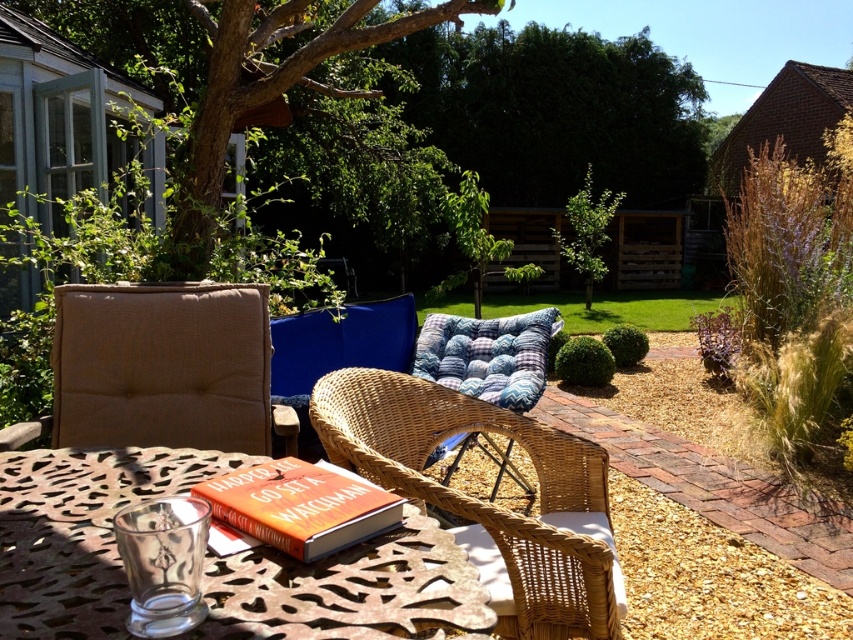
You are sitting at the round metal table in the garden. You want to read the hardcover book at center but notice the green leafy tree at upper left might be casting a shadow. Is the tree blocking sunlight from reaching the book?

The green leafy tree at upper left is positioned over the hardcover book at center, so it is likely casting a shadow and blocking sunlight from reaching the book.

You are standing in the garden and want to place a small potted plant between the two points, point (397, 563) and point (355, 97). Which point should the potted plant be closer to in order to be nearer to you?

The potted plant should be closer to point (397, 563) because it is nearer to the viewer than point (355, 97).

You are planning to set up a reading nook in your garden and want to place a large book like the one shown on the table. Considering the size of the woven wicker armchair at center and the green leafy tree at upper left, which object would be more suitable to place the book on?

The green leafy tree at upper left is larger than the woven wicker armchair at center, so placing the large book on the green leafy tree at upper left would be more suitable.